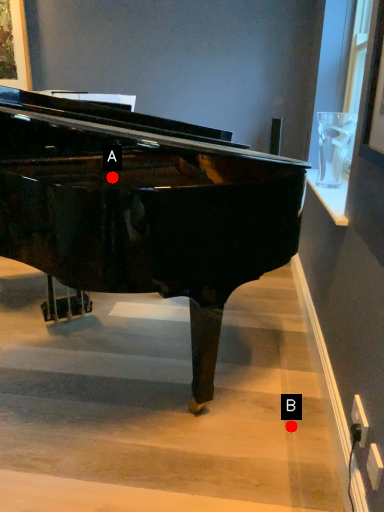
Question: Two points are circled on the image, labeled by A and B beside each circle. Which of the following is the closest to the observer?

Choices:
 (A) A is closer
 (B) B is closer

Answer: (B)